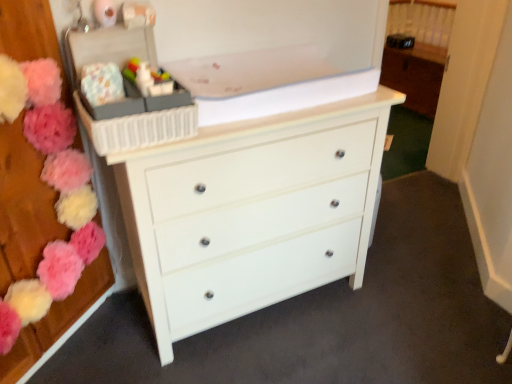
Question: In terms of height, does white glossy chest of drawers at center look taller or shorter compared to matte plastic toy at upper center?

Choices:
 (A) tall
 (B) short

Answer: (A)

Question: Does point (225, 228) appear closer or farther from the camera than point (143, 72)?

Choices:
 (A) farther
 (B) closer

Answer: (A)

Question: Estimate the real-world distances between objects in this image. Which object is closer to the plastic storage box at upper left?

Choices:
 (A) fluffy fabric flowers at left, marked as the 2th flower in a right-to-left arrangement
 (B) white glossy chest of drawers at center
 (C) pastel floral fabric at upper left, arranged as the second flower when viewed from the left
 (D) white glossy cabinet at upper right
 (E) matte plastic toy at upper center

Answer: (E)

Question: Which of these objects is positioned closest to the fluffy fabric flowers at left, which appears as the first flower when viewed from the left?

Choices:
 (A) plastic storage box at upper left
 (B) white glossy cabinet at upper right
 (C) pastel floral fabric at upper left, arranged as the second flower when viewed from the left
 (D) matte plastic toy at upper center
 (E) white glossy chest of drawers at center

Answer: (A)